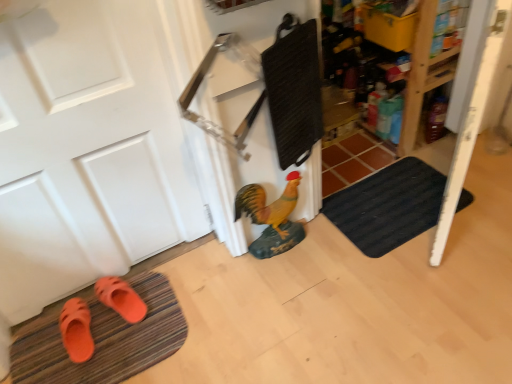
The width and height of the screenshot is (512, 384). In order to click on vacant area that is in front of orange rubber slipper at lower left, arranged as the 1th footwear when viewed from the right in this screenshot , I will do `click(120, 352)`.